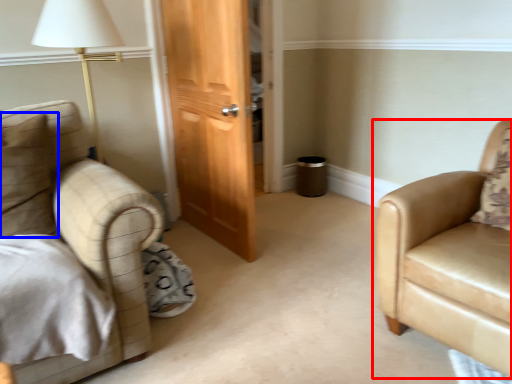
Question: Which of the following is the farthest to the observer, chair (highlighted by a red box) or pillow (highlighted by a blue box)?

Choices:
 (A) chair
 (B) pillow

Answer: (B)